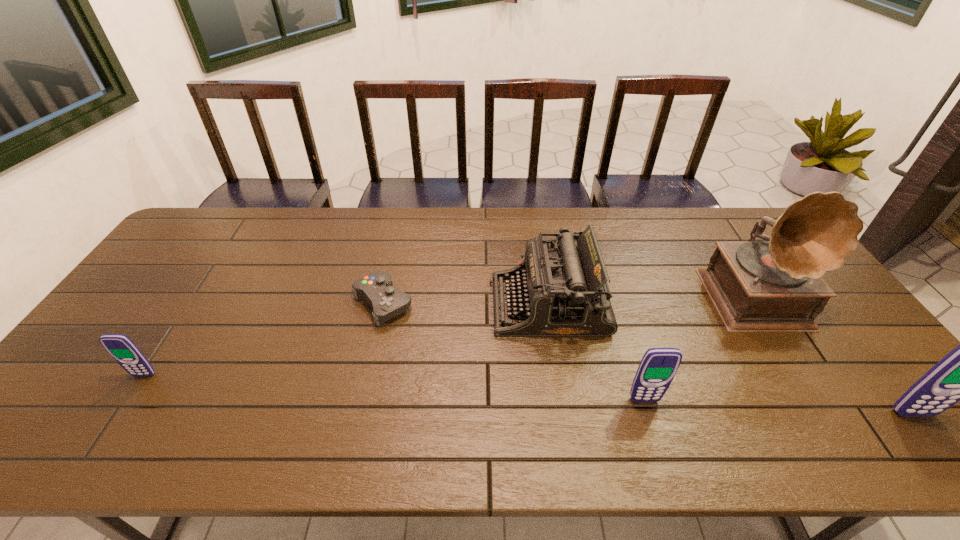
Where is `the third nearest object`? The width and height of the screenshot is (960, 540). the third nearest object is located at coordinates (120, 347).

Where is `the leftmost object`? This screenshot has width=960, height=540. the leftmost object is located at coordinates (120, 347).

This screenshot has width=960, height=540. I want to click on the second cellular telephone from right to left, so click(x=658, y=366).

Locate an element on the screen. the second nearest object is located at coordinates (658, 366).

In order to click on the nearest object in this screenshot , I will do `click(959, 376)`.

At what (x,y) coordinates should I click in order to perform the action: click on the second tallest object. Please return your answer as a coordinate pair (x, y). This screenshot has height=540, width=960. Looking at the image, I should click on (959, 376).

Locate an element on the screen. typewriter is located at coordinates (561, 292).

This screenshot has width=960, height=540. What are the coordinates of `the fifth object from right to left` in the screenshot? It's located at (377, 288).

This screenshot has height=540, width=960. Identify the location of the shortest object. (377, 288).

The height and width of the screenshot is (540, 960). I want to click on record player, so click(x=777, y=286).